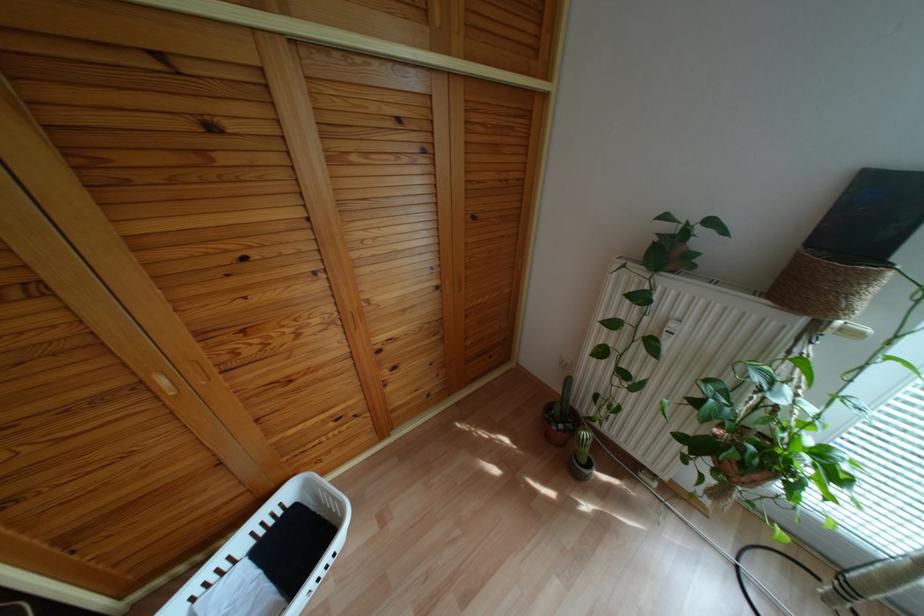
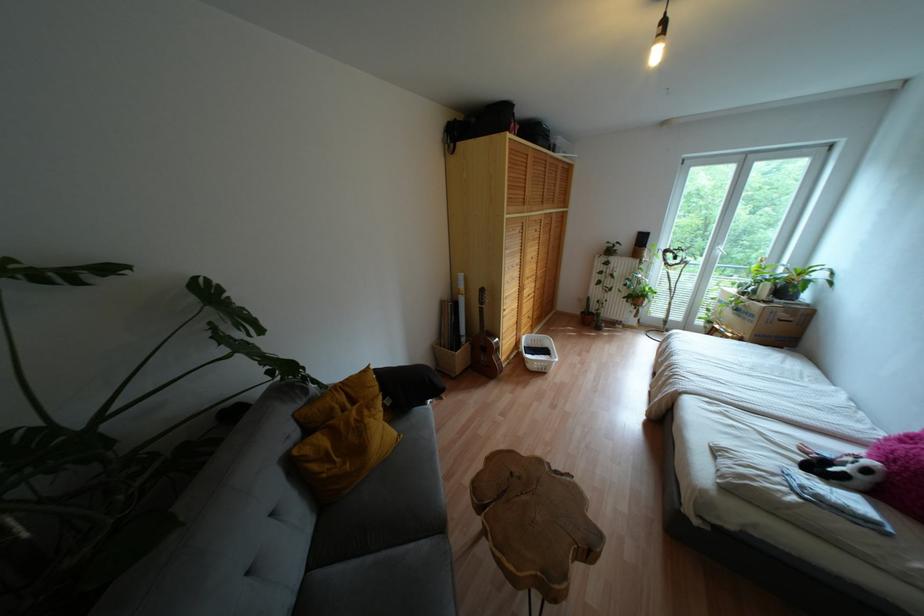
What movement of the cameraman would produce the second image?

The cameraman walked toward left, backward.